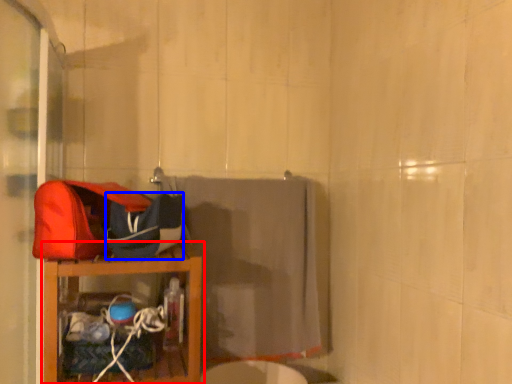
Question: Which of the following is the closest to the observer, furniture (highlighted by a red box) or kit (highlighted by a blue box)?

Choices:
 (A) furniture
 (B) kit

Answer: (A)